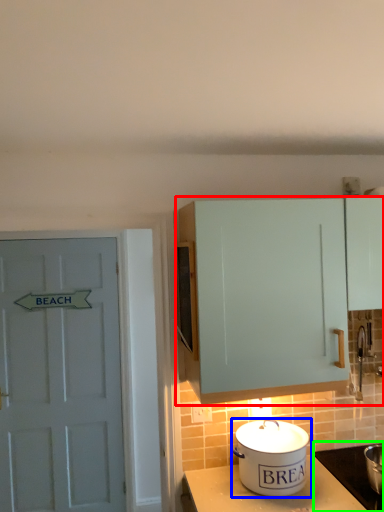
Question: Based on their relative distances, which object is nearer to cabinetry (highlighted by a red box)? Choose from kitchen appliance (highlighted by a blue box) and appliance (highlighted by a green box).

Choices:
 (A) kitchen appliance
 (B) appliance

Answer: (A)